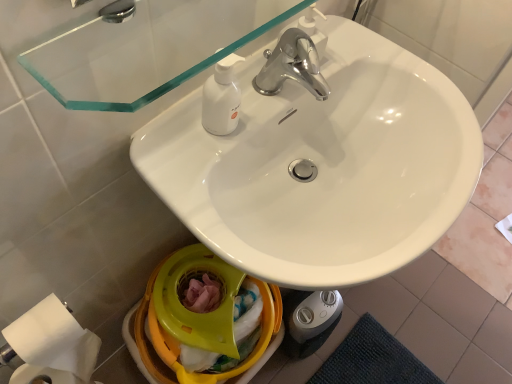
Question: Is transparent glass mirror at upper center aimed at yellow plastic bidet at lower center?

Choices:
 (A) yes
 (B) no

Answer: (B)

Question: Does transparent glass mirror at upper center appear on the left side of yellow plastic bidet at lower center?

Choices:
 (A) yes
 (B) no

Answer: (B)

Question: From a real-world perspective, is transparent glass mirror at upper center located higher than yellow plastic bidet at lower center?

Choices:
 (A) yes
 (B) no

Answer: (A)

Question: Is transparent glass mirror at upper center taller than yellow plastic bidet at lower center?

Choices:
 (A) no
 (B) yes

Answer: (A)

Question: Are transparent glass mirror at upper center and yellow plastic bidet at lower center located far from each other?

Choices:
 (A) no
 (B) yes

Answer: (A)

Question: Is yellow plastic bidet at lower center located within transparent glass mirror at upper center?

Choices:
 (A) yes
 (B) no

Answer: (B)

Question: Is yellow plastic bidet at lower center not inside white matte toilet paper at lower left?

Choices:
 (A) no
 (B) yes

Answer: (B)

Question: Does yellow plastic bidet at lower center turn towards white matte toilet paper at lower left?

Choices:
 (A) yes
 (B) no

Answer: (B)

Question: From the image's perspective, is yellow plastic bidet at lower center beneath white matte toilet paper at lower left?

Choices:
 (A) no
 (B) yes

Answer: (B)

Question: Is yellow plastic bidet at lower center looking in the opposite direction of white matte toilet paper at lower left?

Choices:
 (A) no
 (B) yes

Answer: (A)

Question: Is yellow plastic bidet at lower center in contact with white matte toilet paper at lower left?

Choices:
 (A) no
 (B) yes

Answer: (A)

Question: Can you confirm if yellow plastic bidet at lower center is taller than white matte toilet paper at lower left?

Choices:
 (A) no
 (B) yes

Answer: (B)

Question: Could you tell me if yellow plastic bidet at lower center is facing transparent glass mirror at upper center?

Choices:
 (A) no
 (B) yes

Answer: (A)